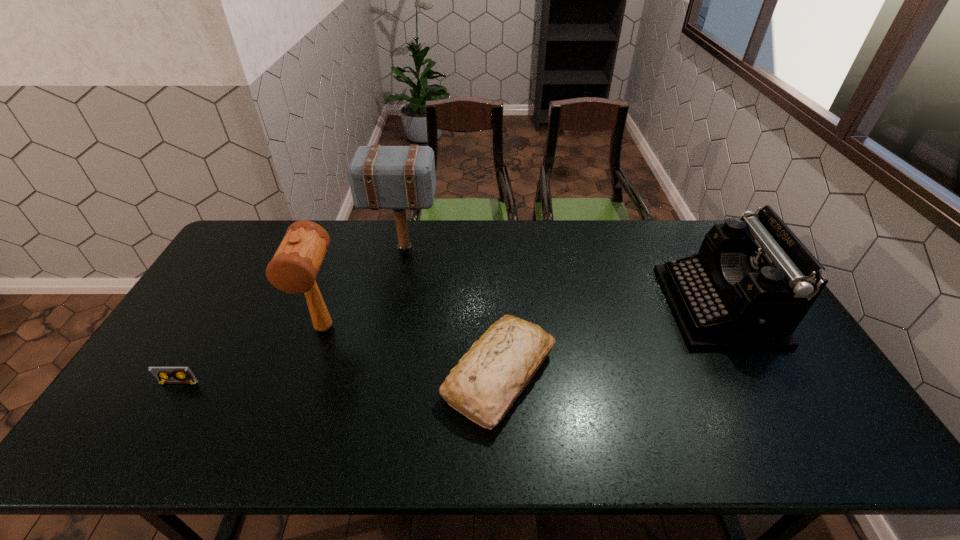
Locate an element on the screen. The width and height of the screenshot is (960, 540). free space between the nearer mallet and the third object from left to right is located at coordinates (364, 289).

What are the coordinates of `blank region between the second object from right to left and the shortest object` in the screenshot? It's located at (339, 379).

Identify the location of free space between the left mallet and the right mallet. This screenshot has height=540, width=960. (364, 289).

Identify the location of vacant area between the bread and the videotape. Image resolution: width=960 pixels, height=540 pixels. point(339,379).

At what (x,y) coordinates should I click in order to perform the action: click on object that is the second nearest to the shortest object. Please return your answer as a coordinate pair (x, y). The height and width of the screenshot is (540, 960). Looking at the image, I should click on (381, 177).

Point out which object is positioned as the fourth nearest to the left mallet. Please provide its 2D coordinates. Your answer should be formatted as a tuple, i.e. [(x, y)], where the tuple contains the x and y coordinates of a point satisfying the conditions above.

[(752, 282)]

Identify the location of vacant region that satisfies the following two spatial constraints: 1. on the striking surface of the right mallet; 2. at the front of the leftmost object with visible reels. (378, 383).

Identify the location of vacant area in the image that satisfies the following two spatial constraints: 1. on the typing side of the third tallest object; 2. at the front of the videotape with visible reels. The width and height of the screenshot is (960, 540). (760, 383).

At what (x,y) coordinates should I click in order to perform the action: click on free space that satisfies the following two spatial constraints: 1. on the typing side of the third tallest object; 2. on the front side of the bread. Please return your answer as a coordinate pair (x, y). This screenshot has width=960, height=540. Looking at the image, I should click on 756,375.

This screenshot has width=960, height=540. I want to click on vacant point that satisfies the following two spatial constraints: 1. on the typing side of the third tallest object; 2. on the front side of the fourth tallest object, so click(x=756, y=375).